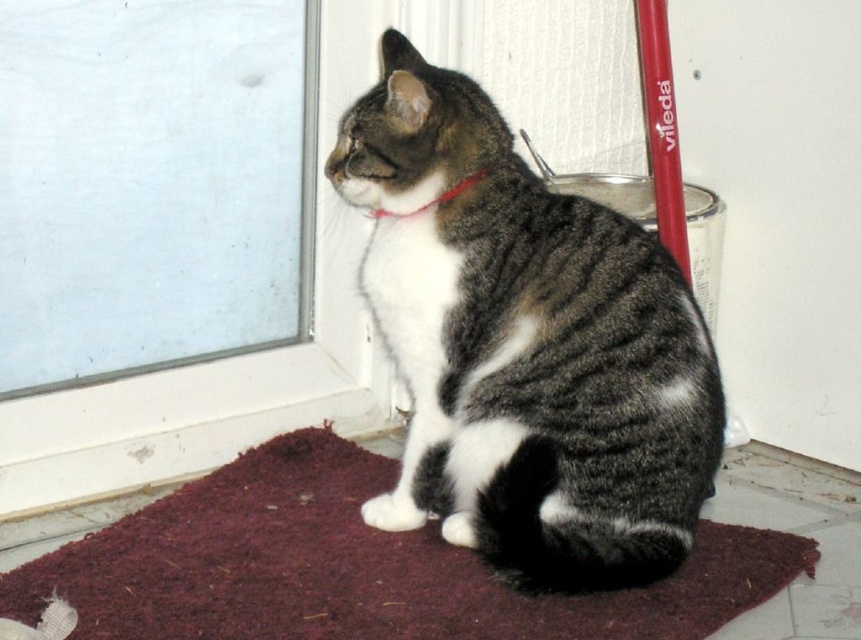
Question: Is tabby fur cat at center smaller than red fabric collar at center?

Choices:
 (A) no
 (B) yes

Answer: (A)

Question: Which point appears closest to the camera in this image?

Choices:
 (A) (448, 198)
 (B) (152, 193)
 (C) (103, 560)
 (D) (414, 237)

Answer: (C)

Question: Does tabby fur cat at center appear on the right side of burgundy carpet at lower center?

Choices:
 (A) yes
 (B) no

Answer: (A)

Question: Considering the real-world distances, which object is farthest from the red fabric collar at center?

Choices:
 (A) burgundy carpet at lower center
 (B) transparent glass door at upper left
 (C) tabby fur cat at center

Answer: (A)

Question: Is tabby fur cat at center wider than red fabric collar at center?

Choices:
 (A) no
 (B) yes

Answer: (B)

Question: Which object appears closest to the camera in this image?

Choices:
 (A) transparent glass door at upper left
 (B) tabby fur cat at center

Answer: (B)